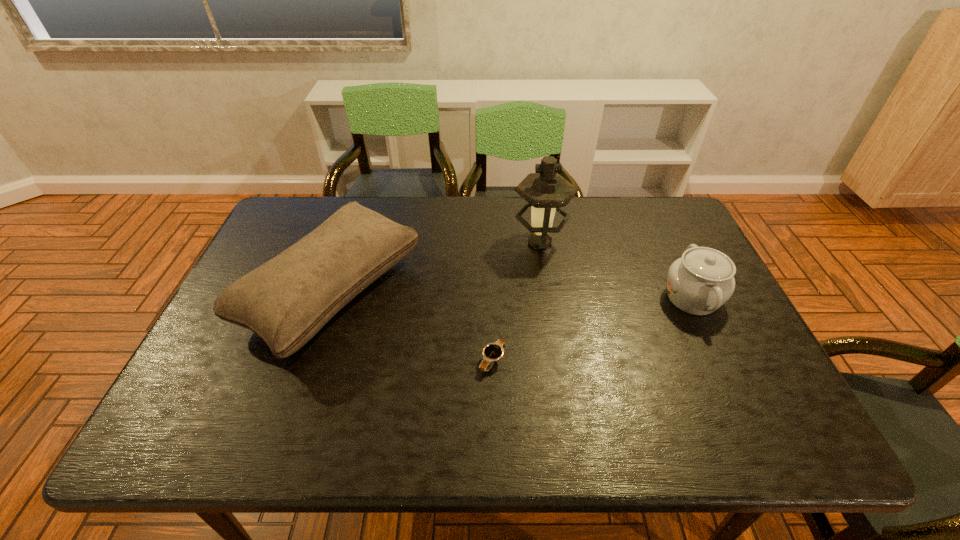
Where is `vacant area between the leftmost object and the chinaware`? vacant area between the leftmost object and the chinaware is located at coordinates (513, 294).

At what (x,y) coordinates should I click in order to perform the action: click on vacant space in between the third object from right to left and the oil lamp. Please return your answer as a coordinate pair (x, y). The image size is (960, 540). Looking at the image, I should click on (516, 301).

Find the location of a particular element. This screenshot has height=540, width=960. vacant space that is in between the shortest object and the tallest object is located at coordinates (516, 301).

Identify the location of empty space that is in between the third object from left to right and the shortest object. (516, 301).

Locate an element on the screen. free space between the third object from left to right and the leftmost object is located at coordinates (437, 266).

Locate an element on the screen. vacant region between the leftmost object and the third object from right to left is located at coordinates (413, 325).

What are the coordinates of `free space between the third object from right to left and the rightmost object` in the screenshot? It's located at (592, 329).

Where is `free spot between the chinaware and the oil lamp`? This screenshot has width=960, height=540. free spot between the chinaware and the oil lamp is located at coordinates [x=616, y=271].

I want to click on vacant point located between the tallest object and the leftmost object, so [437, 266].

Identify which object is located as the nearest to the third object from right to left. Please provide its 2D coordinates. Your answer should be formatted as a tuple, i.e. [(x, y)], where the tuple contains the x and y coordinates of a point satisfying the conditions above.

[(286, 301)]